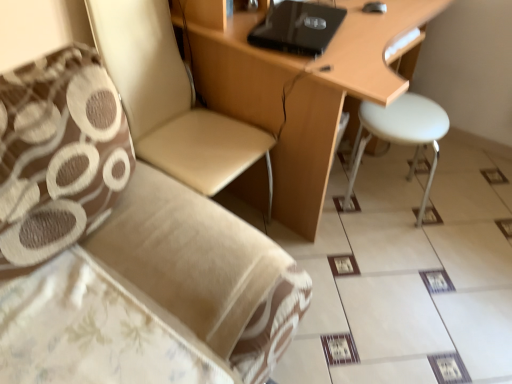
Question: Does point (222, 147) appear closer or farther from the camera than point (83, 130)?

Choices:
 (A) closer
 (B) farther

Answer: (B)

Question: Based on their sizes in the image, would you say beige fabric chair at upper left is bigger or smaller than brown textured pillow at left?

Choices:
 (A) small
 (B) big

Answer: (B)

Question: Which object is positioned farthest from the brown textured pillow at left?

Choices:
 (A) white plastic stool at right
 (B) black matte laptop at upper center
 (C) beige fabric chair at upper left
 (D) light brown wood desk at center

Answer: (A)

Question: Estimate the real-world distances between objects in this image. Which object is closer to the light brown wood desk at center?

Choices:
 (A) brown textured pillow at left
 (B) black matte laptop at upper center
 (C) beige fabric chair at upper left
 (D) white plastic stool at right

Answer: (B)